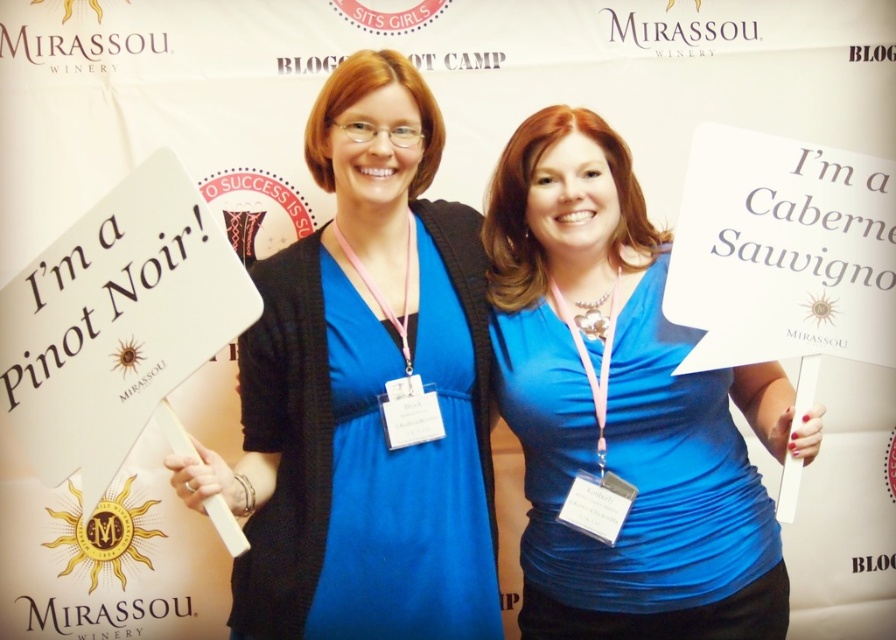
Question: Which object is closer to the camera taking this photo?

Choices:
 (A) matte blue shirt at center
 (B) blue matte dress at center

Answer: (B)

Question: Can you confirm if blue matte dress at center is positioned to the right of matte blue shirt at center?

Choices:
 (A) no
 (B) yes

Answer: (A)

Question: Which object appears closest to the camera in this image?

Choices:
 (A) matte blue shirt at center
 (B) blue matte dress at center

Answer: (B)

Question: Among these points, which one is nearest to the camera?

Choices:
 (A) (627, 211)
 (B) (375, 221)

Answer: (B)

Question: In this image, where is blue matte dress at center located relative to matte blue shirt at center?

Choices:
 (A) right
 (B) left

Answer: (B)

Question: Does blue matte dress at center appear on the left side of matte blue shirt at center?

Choices:
 (A) yes
 (B) no

Answer: (A)